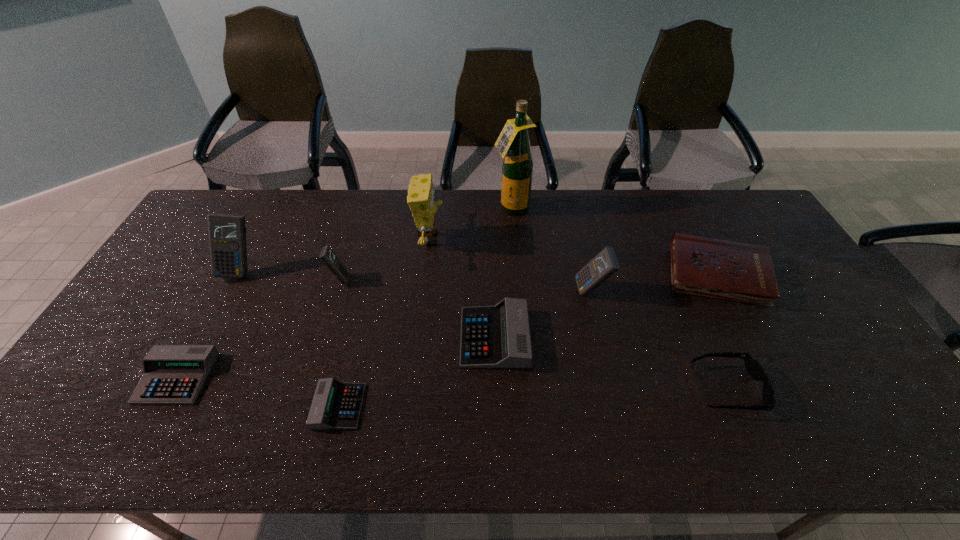
The width and height of the screenshot is (960, 540). I want to click on liquor, so click(x=513, y=142).

Where is `sponge`? This screenshot has height=540, width=960. sponge is located at coordinates (421, 194).

Find the location of a particular element. The width and height of the screenshot is (960, 540). yellow sponge is located at coordinates (421, 194).

At what (x,y) coordinates should I click in order to perform the action: click on the biggest blue calculator. Please return your answer as a coordinate pair (x, y). This screenshot has width=960, height=540. Looking at the image, I should click on (227, 234).

The width and height of the screenshot is (960, 540). Identify the location of the tallest calculator. (227, 234).

The height and width of the screenshot is (540, 960). In order to click on the rightmost calculator in this screenshot , I will do coord(603,265).

You are a GUI agent. You are given a task and a screenshot of the screen. Output one action in this format:
    pyautogui.click(x=<x>, y=<y>)
    Task: Click on the rightmost blue calculator
    This screenshot has height=540, width=960.
    Given the screenshot: What is the action you would take?
    pyautogui.click(x=603, y=265)

You are a GUI agent. You are given a task and a screenshot of the screen. Output one action in this format:
    pyautogui.click(x=<x>, y=<y>)
    Task: Click on the third calculator from left to right
    
    Given the screenshot: What is the action you would take?
    pyautogui.click(x=328, y=257)

The height and width of the screenshot is (540, 960). I want to click on the third object from left to right, so click(x=328, y=257).

Where is `the sixth tallest object`? The width and height of the screenshot is (960, 540). the sixth tallest object is located at coordinates (743, 272).